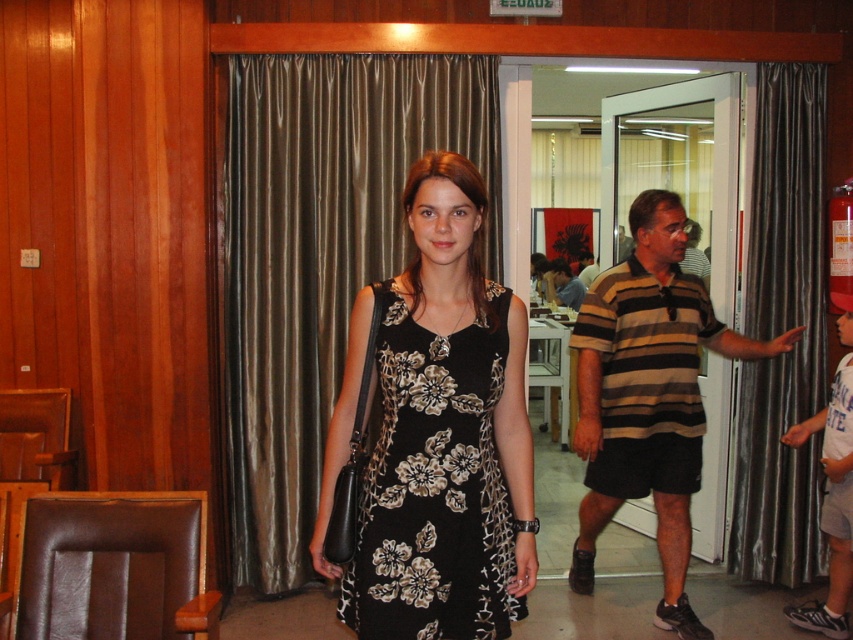
Question: Is brown silk curtain at center wider than striped cotton shirt at center?

Choices:
 (A) no
 (B) yes

Answer: (B)

Question: Which point is farther to the camera?

Choices:
 (A) brown silk curtain at center
 (B) silky brown curtain at right
 (C) black floral-patterned dress at center
 (D) striped cotton shirt at center

Answer: (B)

Question: From the image, what is the correct spatial relationship of striped cotton shirt at center in relation to silky brown curtain at right?

Choices:
 (A) below
 (B) above

Answer: (A)

Question: Among these objects, which one is nearest to the camera?

Choices:
 (A) brown silk curtain at center
 (B) floral fabric dress at center
 (C) black floral-patterned dress at center
 (D) striped cotton shirt at center

Answer: (C)

Question: Is brown silk curtain at center in front of silky brown curtain at right?

Choices:
 (A) yes
 (B) no

Answer: (A)

Question: Which point appears closest to the camera in this image?

Choices:
 (A) (793, 269)
 (B) (616, 355)

Answer: (B)